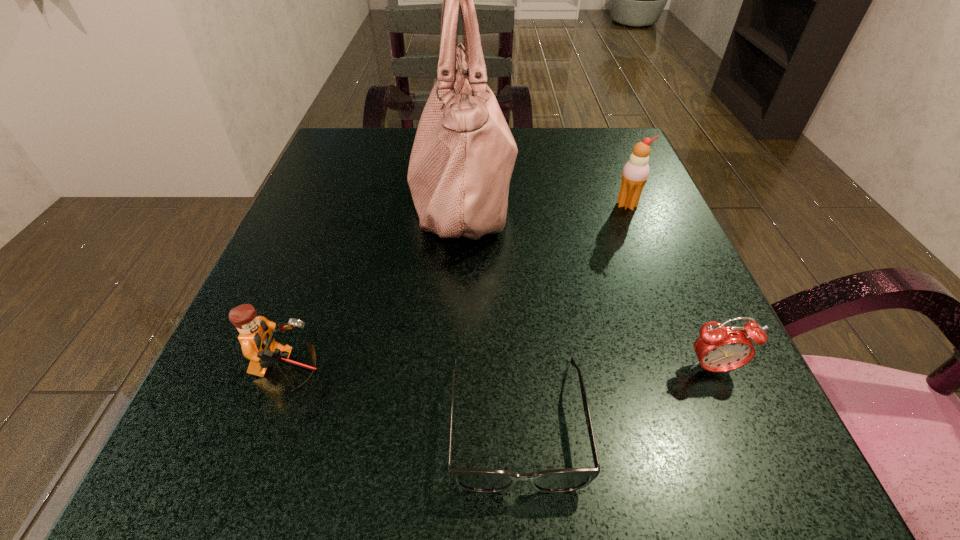
I want to click on object that is positioned at the near edge, so click(x=481, y=480).

Image resolution: width=960 pixels, height=540 pixels. What are the coordinates of `object situated at the left edge` in the screenshot? It's located at (256, 338).

Where is `icecream that is at the right edge`? Image resolution: width=960 pixels, height=540 pixels. icecream that is at the right edge is located at coordinates (x=635, y=173).

This screenshot has height=540, width=960. I want to click on alarm clock positioned at the right edge, so click(x=719, y=348).

Where is `vacant area at the far edge of the desktop`? Image resolution: width=960 pixels, height=540 pixels. vacant area at the far edge of the desktop is located at coordinates point(530,178).

In the image, there is a desktop. Where is `vacant space at the near edge`? vacant space at the near edge is located at coordinates (618, 497).

What are the coordinates of `vacant space at the left edge` in the screenshot? It's located at (332, 276).

Where is `vacant space at the right edge`? The image size is (960, 540). vacant space at the right edge is located at coordinates (675, 234).

Identify the location of vacant space at the far left corner of the desktop. The image size is (960, 540). (364, 173).

Locate an element on the screen. The width and height of the screenshot is (960, 540). free space between the alarm clock and the icecream is located at coordinates (669, 287).